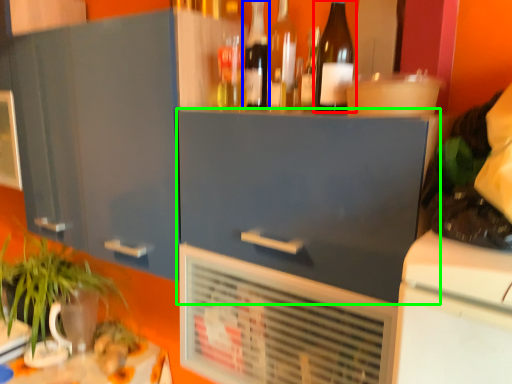
Question: Which is nearer to the bottle (highlighted by a red box)? bottle (highlighted by a blue box) or cabinetry (highlighted by a green box).

Choices:
 (A) bottle
 (B) cabinetry

Answer: (A)